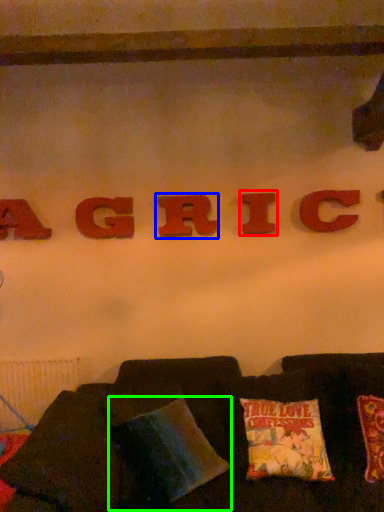
Question: Based on their relative distances, which object is farther from letter (highlighted by a red box)? Choose from letter (highlighted by a blue box) and pillow (highlighted by a green box).

Choices:
 (A) letter
 (B) pillow

Answer: (B)